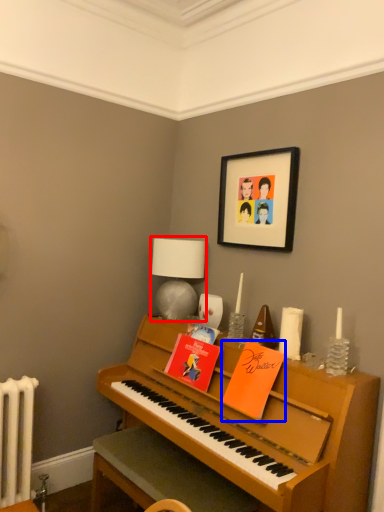
Question: Which object appears closest to the camera in this image, table lamp (highlighted by a red box) or book (highlighted by a blue box)?

Choices:
 (A) table lamp
 (B) book

Answer: (B)